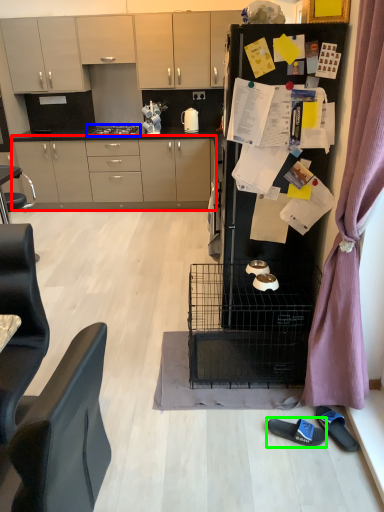
Question: Which object is the farthest from cabinetry (highlighted by a red box)? Choose among these: home appliance (highlighted by a blue box) or footwear (highlighted by a green box).

Choices:
 (A) home appliance
 (B) footwear

Answer: (B)